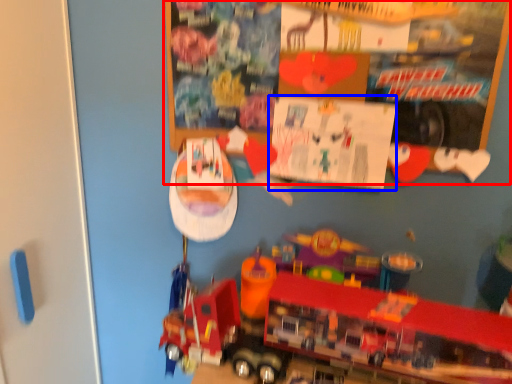
Question: Which object is closer to the camera taking this photo, bulletin board (highlighted by a red box) or poster page (highlighted by a blue box)?

Choices:
 (A) bulletin board
 (B) poster page

Answer: (A)